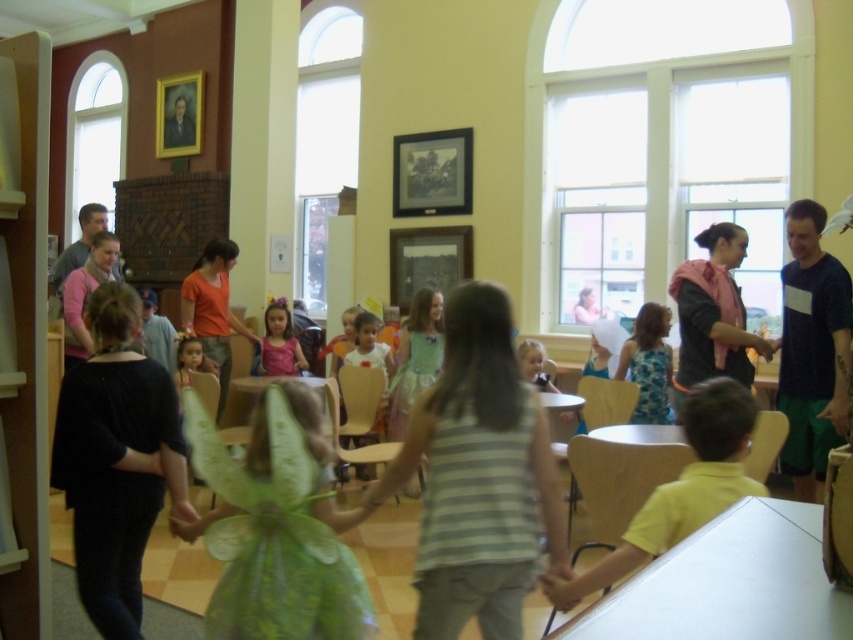
You are standing at the entrance of the room and want to find the yellow matte shirt at lower right. According to the coordinate system where the bottom left corner is the origin, can you estimate its location?

The yellow matte shirt at lower right is located at coordinates approximately 0.762 on the x axis and 0.800 on the y axis.

You are a fashion designer observing two dresses displayed in the center of a cozy room. Which dress is taller between the green fabric dress at center and the pink satin dress at center?

The green fabric dress at center is taller than the pink satin dress at center.